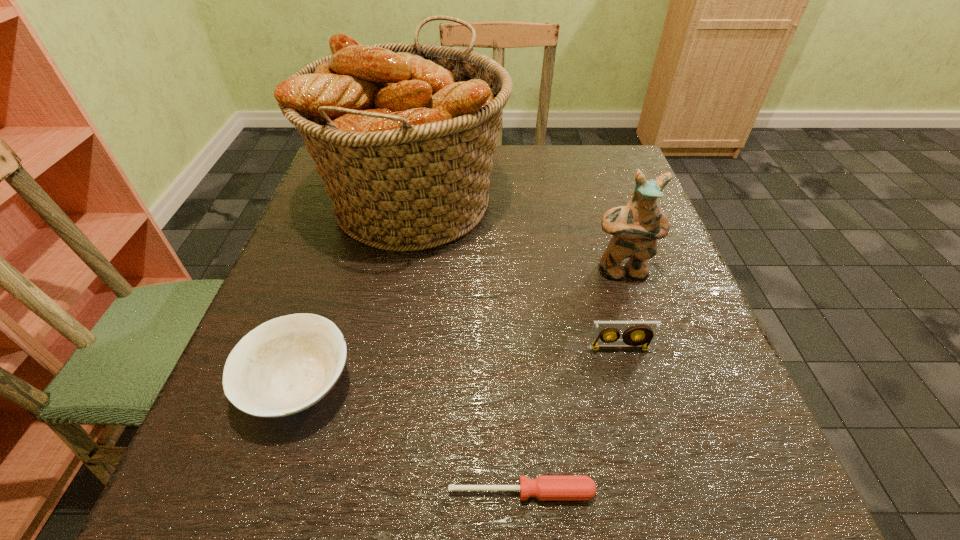
Image resolution: width=960 pixels, height=540 pixels. I want to click on vacant space at the left edge of the desktop, so click(x=316, y=210).

The height and width of the screenshot is (540, 960). Identify the location of free space at the right edge of the desktop. pyautogui.click(x=626, y=306).

Locate an element on the screen. Image resolution: width=960 pixels, height=540 pixels. vacant space at the far right corner of the desktop is located at coordinates (609, 177).

Find the location of a particular element. This screenshot has height=540, width=960. vacant space at the near right corner of the desktop is located at coordinates (713, 479).

The height and width of the screenshot is (540, 960). I want to click on vacant space that is in between the videotape and the fourth shortest object, so (620, 309).

Where is `free space between the videotape and the tallest object`? The height and width of the screenshot is (540, 960). free space between the videotape and the tallest object is located at coordinates (516, 276).

Image resolution: width=960 pixels, height=540 pixels. I want to click on empty space between the second tallest object and the videotape, so click(620, 309).

You are a GUI agent. You are given a task and a screenshot of the screen. Output one action in this format:
    pyautogui.click(x=<x>, y=<y>)
    Task: Click on the free space between the basket and the bowl
    The height and width of the screenshot is (540, 960).
    Given the screenshot: What is the action you would take?
    pyautogui.click(x=356, y=294)

Locate an element on the screen. This screenshot has height=540, width=960. free spot between the screwdriver and the bowl is located at coordinates (411, 438).

Where is `unoccupied area between the tallest object and the figurine`? The image size is (960, 540). unoccupied area between the tallest object and the figurine is located at coordinates (517, 237).